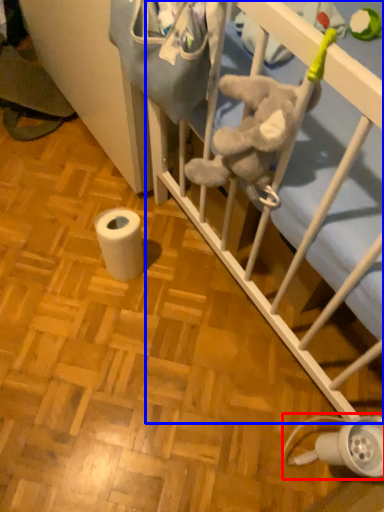
Question: Which of the following is the closest to the observer, lamp (highlighted by a red box) or infant bed (highlighted by a blue box)?

Choices:
 (A) lamp
 (B) infant bed

Answer: (A)